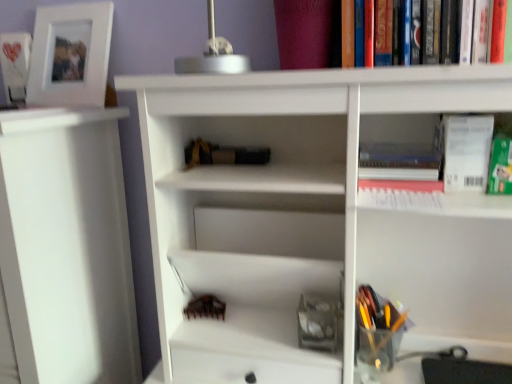
Question: Would you say white matte picture frame at upper left is to the left or to the right of translucent plastic pen holder at lower right in the picture?

Choices:
 (A) right
 (B) left

Answer: (B)

Question: In the image, is white matte picture frame at upper left positioned in front of or behind translucent plastic pen holder at lower right?

Choices:
 (A) behind
 (B) front

Answer: (A)

Question: Which is farther from the black matte book at center, the second book when ordered from right to left?

Choices:
 (A) hardcover book at upper right, which is the first book from bottom to top
 (B) white matte picture frame at upper left
 (C) translucent plastic pen holder at lower right
 (D) white matte shelf at left
 (E) white paper at upper right

Answer: (C)

Question: Estimate the real-world distances between objects in this image. Which object is closer to the white matte picture frame at upper left?

Choices:
 (A) white paper at upper right
 (B) hardcover book at upper right, marked as the third book in a top-to-bottom arrangement
 (C) translucent plastic pen holder at lower right
 (D) white matte shelf at left
 (E) white matte photo frame at upper left, placed as the third book when sorted from right to left

Answer: (E)